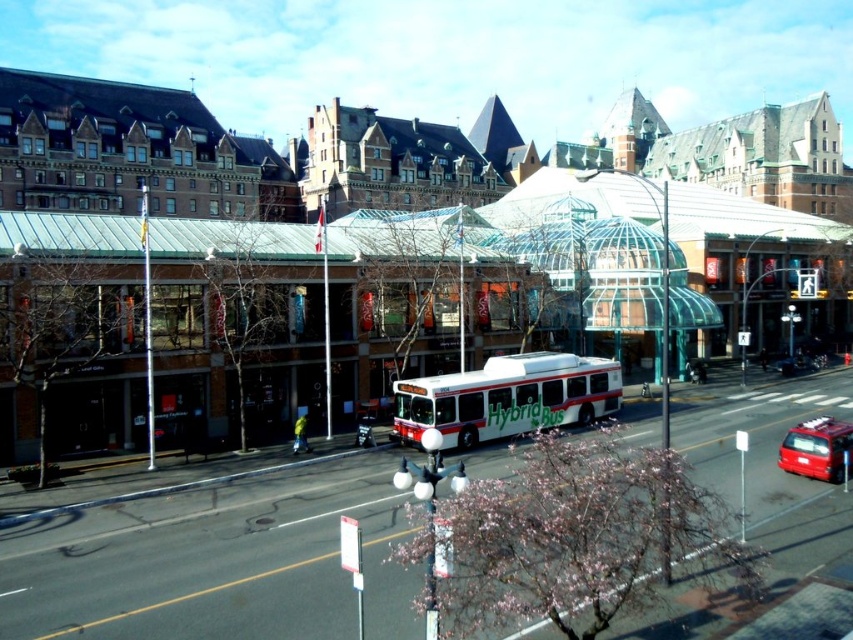
Question: Which object is positioned farthest from the shiny red van at lower right?

Choices:
 (A) white hybrid bus at center
 (B) metallic red car at center

Answer: (B)

Question: Which object is positioned closest to the metallic red car at center?

Choices:
 (A) white hybrid bus at center
 (B) shiny red van at lower right

Answer: (B)

Question: Is white hybrid bus at center thinner than metallic red car at center?

Choices:
 (A) no
 (B) yes

Answer: (A)

Question: Which point is closer to the camera?

Choices:
 (A) (781, 360)
 (B) (399, 388)
 (C) (820, 456)

Answer: (C)

Question: Is white hybrid bus at center below metallic red car at center?

Choices:
 (A) yes
 (B) no

Answer: (A)

Question: Does white hybrid bus at center have a greater width compared to shiny red van at lower right?

Choices:
 (A) yes
 (B) no

Answer: (A)